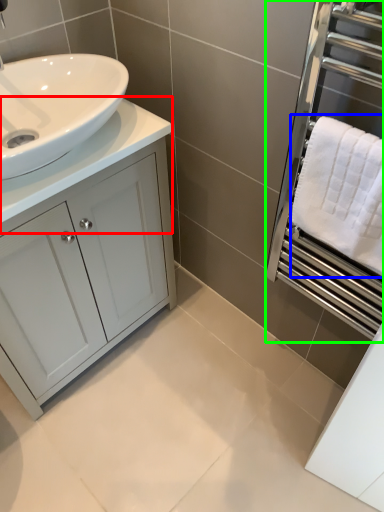
Question: Which object is the closest to the counter top (highlighted by a red box)? Choose among these: bath towel (highlighted by a blue box) or screen door (highlighted by a green box).

Choices:
 (A) bath towel
 (B) screen door

Answer: (A)